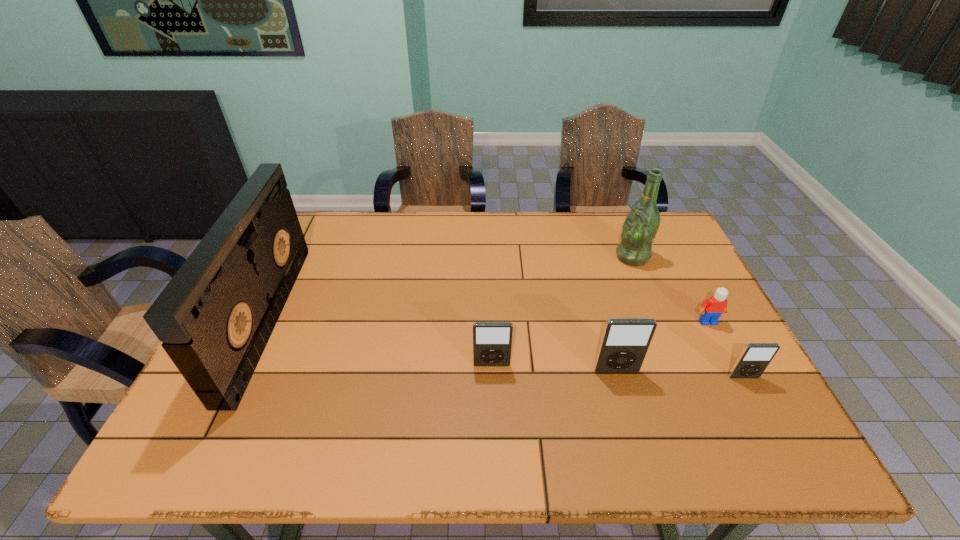
Identify the location of free spot between the nearest iPod and the second farthest iPod. (680, 374).

Where is `vacant area between the rightmost iPod and the third object from right to left`? The image size is (960, 540). vacant area between the rightmost iPod and the third object from right to left is located at coordinates (688, 317).

This screenshot has height=540, width=960. I want to click on vacant point located between the beer bottle and the farthest iPod, so click(x=562, y=311).

At what (x,y) coordinates should I click in order to perform the action: click on empty space that is in between the rightmost iPod and the third object from right to left. Please return your answer as a coordinate pair (x, y). Looking at the image, I should click on (688, 317).

Locate an element on the screen. Image resolution: width=960 pixels, height=540 pixels. free spot between the tallest iPod and the leftmost object is located at coordinates [x=442, y=345].

The width and height of the screenshot is (960, 540). I want to click on free space between the beer bottle and the leftmost object, so click(450, 288).

Find the location of a particular element. The height and width of the screenshot is (540, 960). vacant point located between the fourth object from left to right and the Lego is located at coordinates (670, 289).

Locate an element on the screen. empty space between the Lego and the nearest iPod is located at coordinates (726, 349).

Where is `object that can be found as the closest to the third object from left to right`? object that can be found as the closest to the third object from left to right is located at coordinates (492, 341).

Point out which object is positioned as the nearest to the tallest iPod. Please provide its 2D coordinates. Your answer should be formatted as a tuple, i.e. [(x, y)], where the tuple contains the x and y coordinates of a point satisfying the conditions above.

[(492, 341)]